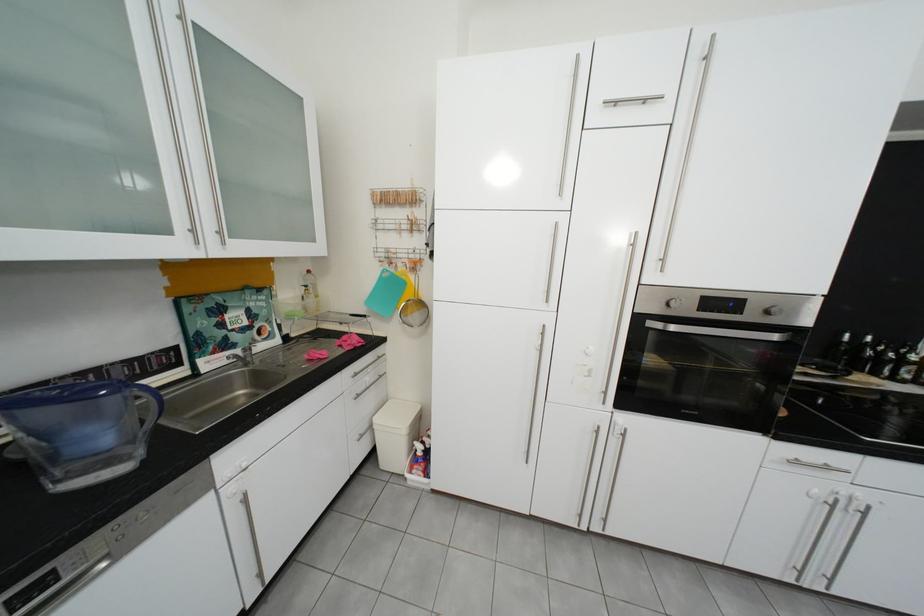
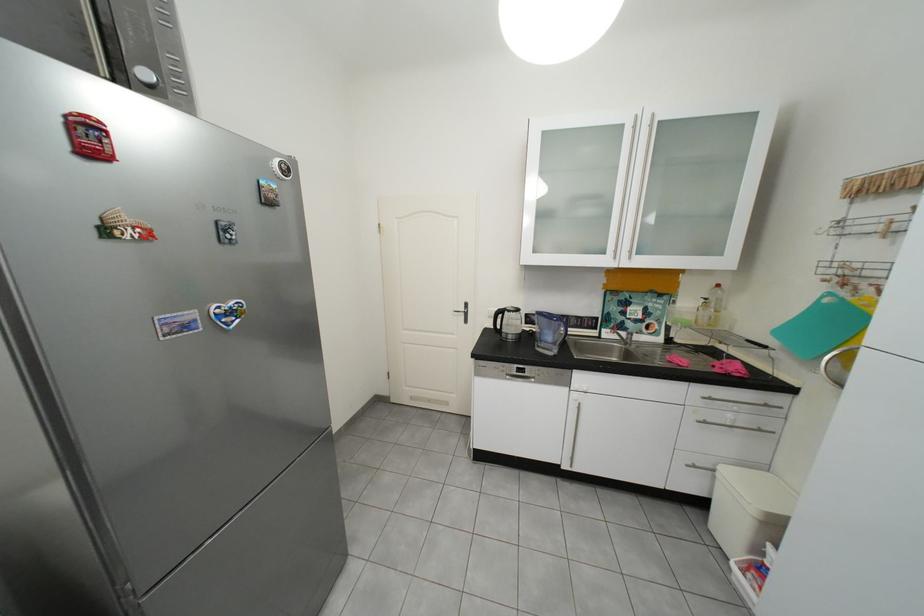
Where in the second image is the point corresponding to (x=318, y=286) from the first image?

(718, 300)